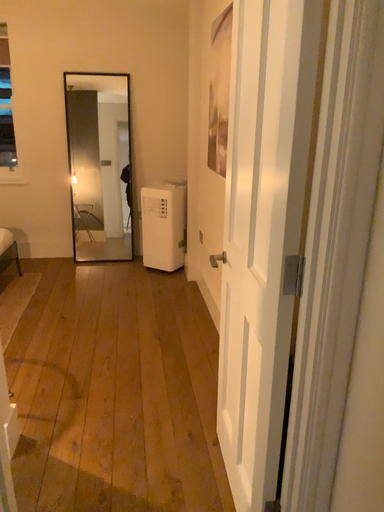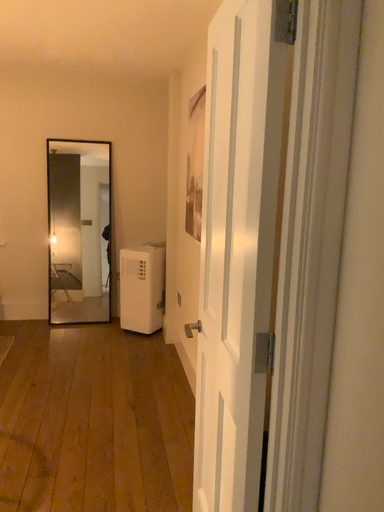
Question: How did the camera likely rotate when shooting the video?

Choices:
 (A) rotated downward
 (B) rotated upward

Answer: (B)